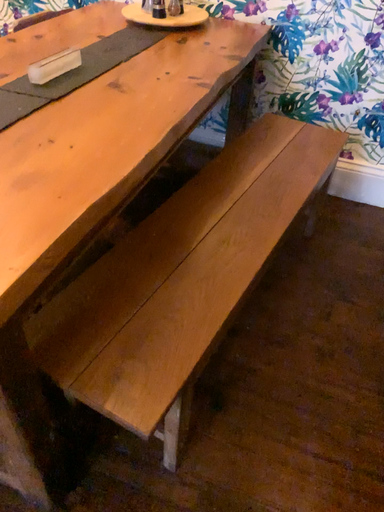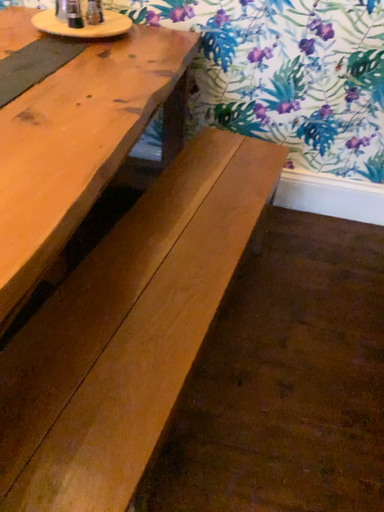
Question: How did the camera likely rotate when shooting the video?

Choices:
 (A) rotated right
 (B) rotated left

Answer: (A)